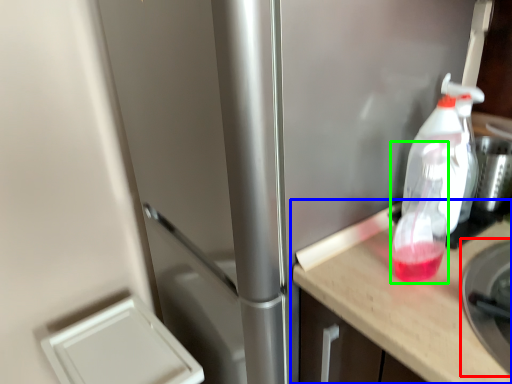
Question: Based on their relative distances, which object is farther from appliance (highlighted by a red box)? Choose from countertop (highlighted by a blue box) and bottle (highlighted by a green box).

Choices:
 (A) countertop
 (B) bottle

Answer: (B)